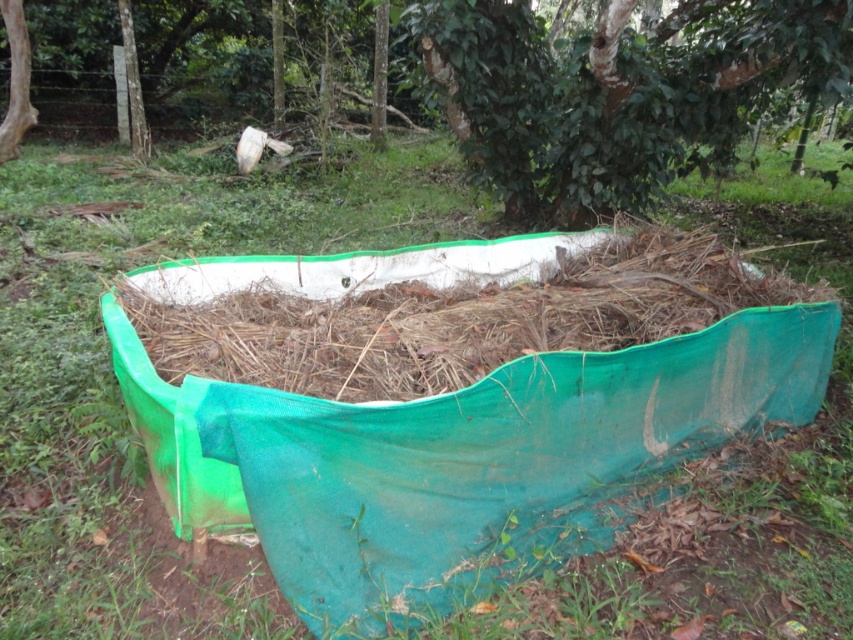
Can you confirm if green leafy tree at upper center is taller than green fabric hay at center?

Yes.

Does point (544, 96) lie in front of point (747, 269)?

No.

Does point (514, 125) come closer to viewer compared to point (737, 273)?

No.

Locate an element on the screen. The height and width of the screenshot is (640, 853). green leafy tree at upper center is located at coordinates (618, 93).